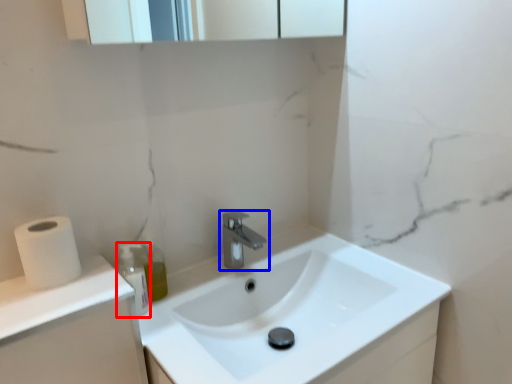
Question: Which object appears farthest to the camera in this image, bottle (highlighted by a red box) or tap (highlighted by a blue box)?

Choices:
 (A) bottle
 (B) tap

Answer: (B)